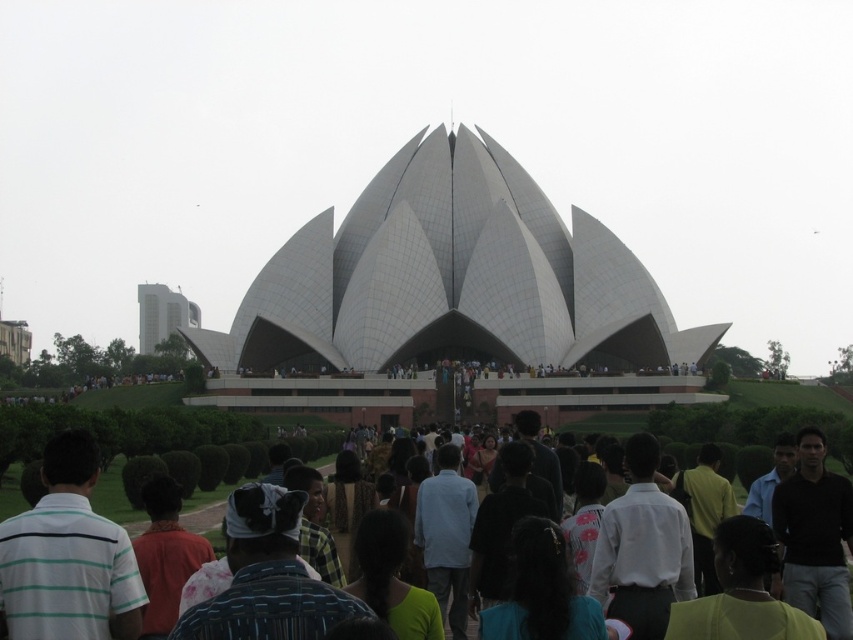
Question: Is white smooth dome at center to the right of white shirt at center from the viewer's perspective?

Choices:
 (A) no
 (B) yes

Answer: (B)

Question: Among these objects, which one is nearest to the camera?

Choices:
 (A) white shirt at center
 (B) white smooth dome at center

Answer: (A)

Question: Can you confirm if white smooth dome at center is positioned to the right of white shirt at center?

Choices:
 (A) no
 (B) yes

Answer: (B)

Question: Is white smooth dome at center to the right of white shirt at center from the viewer's perspective?

Choices:
 (A) yes
 (B) no

Answer: (A)